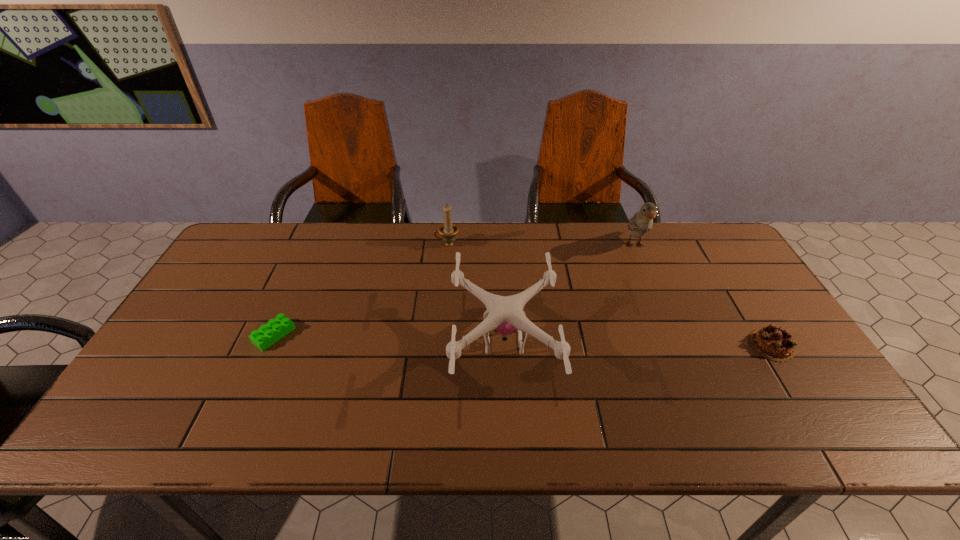
This screenshot has height=540, width=960. Identify the location of bird. (642, 222).

You are a GUI agent. You are given a task and a screenshot of the screen. Output one action in this format:
    pyautogui.click(x=<x>, y=<y>)
    Task: Click on the fourth object from left to right
    Image resolution: width=960 pixels, height=540 pixels.
    Given the screenshot: What is the action you would take?
    pyautogui.click(x=642, y=222)

Locate an element on the screen. The image size is (960, 540). candle_holder is located at coordinates (448, 230).

Identify the location of drone. point(504,314).

The image size is (960, 540). I want to click on chocolate cake, so click(x=773, y=343).

Identify the location of the second shortest object. (773, 343).

Find the location of a particular element. This screenshot has width=960, height=540. Lego is located at coordinates (275, 329).

This screenshot has width=960, height=540. Identify the location of the leftmost object. (275, 329).

The image size is (960, 540). What are the coordinates of `vacant space situated 0.240m at the face of the bird` in the screenshot? It's located at (664, 316).

Locate an element on the screen. This screenshot has height=540, width=960. free point located 0.340m on the handle side of the candle_holder is located at coordinates (333, 244).